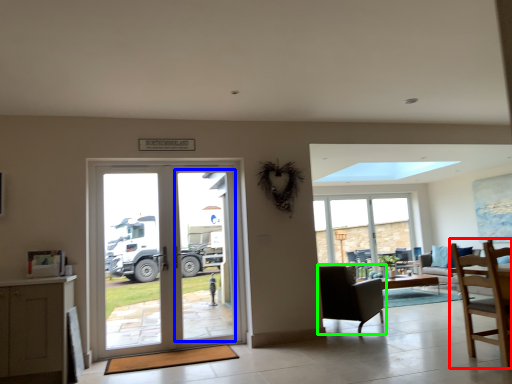
Question: Based on their relative distances, which object is nearer to chair (highlighted by a red box)? Choose from screen door (highlighted by a blue box) and chair (highlighted by a green box).

Choices:
 (A) screen door
 (B) chair

Answer: (B)